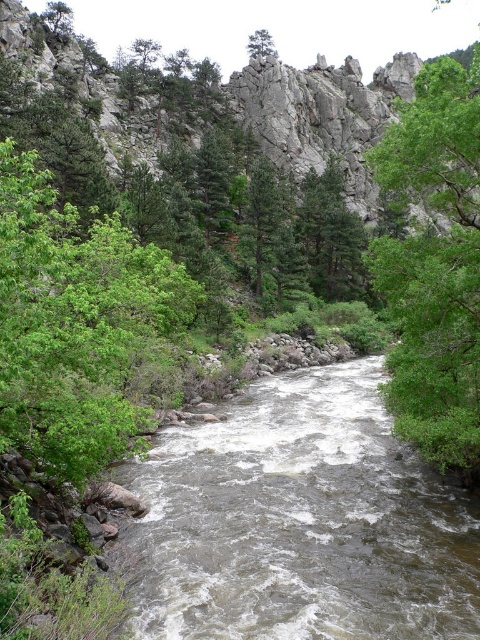
Is brown/rocky stream at center to the left of green matte tree at upper center from the viewer's perspective?

In fact, brown/rocky stream at center is to the right of green matte tree at upper center.

Is point (168, 534) closer to viewer compared to point (262, 45)?

Yes, point (168, 534) is closer to viewer.

The image size is (480, 640). Find the location of `brown/rocky stream at center`. brown/rocky stream at center is located at coordinates click(299, 522).

This screenshot has width=480, height=640. Describe the element at coordinates (74, 323) in the screenshot. I see `green leafy tree at left` at that location.

Can you confirm if green leafy tree at left is smaller than green matte tree at upper center?

Yes, green leafy tree at left is smaller than green matte tree at upper center.

Which is behind, point (131, 410) or point (261, 49)?

Positioned behind is point (261, 49).

Find the location of `green leafy tree at left`. green leafy tree at left is located at coordinates (74, 323).

Does green leafy tree at left have a lesser width compared to green leafy tree at right?

Correct, green leafy tree at left's width is less than green leafy tree at right's.

Between green leafy tree at left and green leafy tree at right, which one is positioned lower?

green leafy tree at left

Where is `green leafy tree at left`? The width and height of the screenshot is (480, 640). green leafy tree at left is located at coordinates (74, 323).